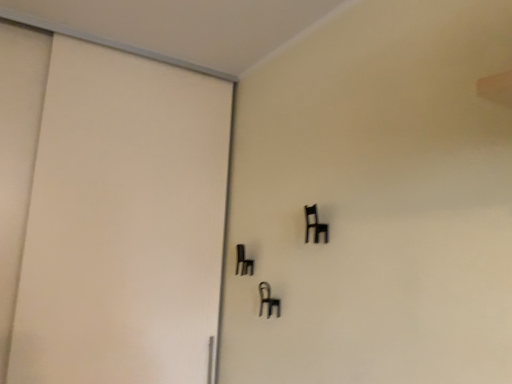
Question: Is black matte chair at center, the 3th furniture positioned from the right, oriented towards matte white door at left?

Choices:
 (A) no
 (B) yes

Answer: (A)

Question: Can you confirm if black matte chair at center, which is counted as the second furniture, starting from the top, is positioned to the right of matte white door at left?

Choices:
 (A) yes
 (B) no

Answer: (A)

Question: Is black matte chair at center, positioned as the second furniture in bottom-to-top order, wider than matte white door at left?

Choices:
 (A) yes
 (B) no

Answer: (B)

Question: Could matte white door at left be considered to be inside black matte chair at center, the 1th furniture when ordered from left to right?

Choices:
 (A) yes
 (B) no

Answer: (B)

Question: Is black matte chair at center, which is counted as the second furniture, starting from the top, bigger than matte white door at left?

Choices:
 (A) no
 (B) yes

Answer: (A)

Question: From the image's perspective, is black matte chair at center, the 1th furniture when ordered from left to right, beneath matte white door at left?

Choices:
 (A) yes
 (B) no

Answer: (A)

Question: Considering the relative sizes of matte white door at left and black matte chair at center, acting as the second furniture starting from the front, in the image provided, is matte white door at left wider than black matte chair at center, acting as the second furniture starting from the front,?

Choices:
 (A) yes
 (B) no

Answer: (A)

Question: From a real-world perspective, is matte white door at left positioned over black matte chair at center, the 2th furniture from the left, based on gravity?

Choices:
 (A) yes
 (B) no

Answer: (A)

Question: Is matte white door at left positioned beyond the bounds of black matte chair at center, which is the second furniture in right-to-left order?

Choices:
 (A) yes
 (B) no

Answer: (A)

Question: Is matte white door at left taller than black matte chair at center, acting as the second furniture starting from the front?

Choices:
 (A) no
 (B) yes

Answer: (B)

Question: Could you tell me if matte white door at left is turned towards black matte chair at center, the 2th furniture from the left?

Choices:
 (A) no
 (B) yes

Answer: (B)

Question: Is matte white door at left at the left side of black matte chair at center, the 2th furniture from the left?

Choices:
 (A) no
 (B) yes

Answer: (B)

Question: From the image's perspective, is matte white door at left beneath black plastic chair at upper right, which is counted as the 1th furniture, starting from the top?

Choices:
 (A) yes
 (B) no

Answer: (A)